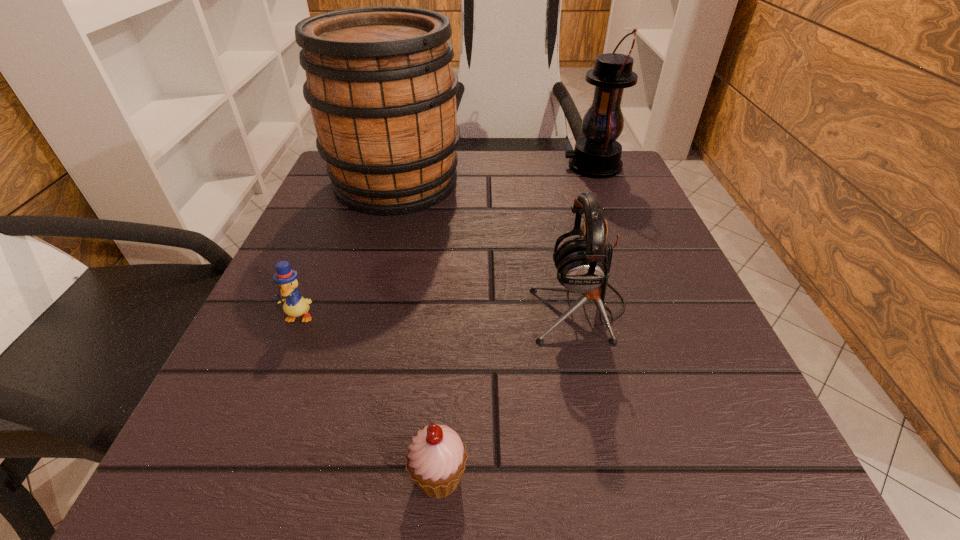
Find the location of a particular element. Image resolution: width=960 pixels, height=540 pixels. cider is located at coordinates click(379, 81).

The height and width of the screenshot is (540, 960). I want to click on lantern, so click(x=597, y=155).

Find the location of a particular element. The image size is (960, 540). the third shortest object is located at coordinates (583, 264).

Locate an element on the screen. The width and height of the screenshot is (960, 540). duckling is located at coordinates (294, 305).

Find the location of a particular element. This screenshot has height=540, width=960. cupcake is located at coordinates (436, 458).

Identify the location of free location located 0.120m on the front of the cider. (375, 259).

Locate several spots in the free space located 0.350m above the lantern, indicating its light source. Please provide its 2D coordinates. Your answer should be formatted as a tuple, i.e. [(x, y)], where the tuple contains the x and y coordinates of a point satisfying the conditions above.

[(414, 166)]

Find a few locations in blank space located 0.100m above the lantern, indicating its light source. Please provide its 2D coordinates. Your answer should be formatted as a tuple, i.e. [(x, y)], where the tuple contains the x and y coordinates of a point satisfying the conditions above.

[(521, 166)]

Locate several spots in the free space located above the lantern, indicating its light source. Please provide its 2D coordinates. Your answer should be formatted as a tuple, i.e. [(x, y)], where the tuple contains the x and y coordinates of a point satisfying the conditions above.

[(419, 166)]

Find the location of a particular element. This screenshot has height=540, width=960. free space located on the back of the third shortest object is located at coordinates (554, 199).